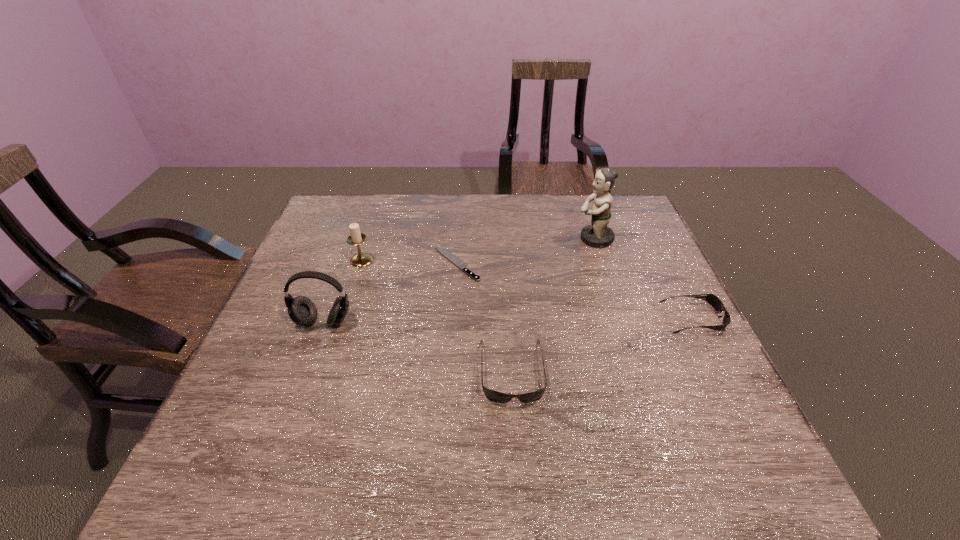
Image resolution: width=960 pixels, height=540 pixels. I want to click on vacant point located on the front-facing side of the tallest object, so click(x=536, y=239).

Locate an element on the screen. The height and width of the screenshot is (540, 960). free space located 0.130m on the front-facing side of the tallest object is located at coordinates (533, 239).

You are a GUI agent. You are given a task and a screenshot of the screen. Output one action in this format:
    pyautogui.click(x=<x>, y=<y>)
    Task: Click on the vacant space situated 0.180m on the front-facing side of the tallest object
    
    Given the screenshot: What is the action you would take?
    (x=516, y=239)

You are a GUI agent. You are given a task and a screenshot of the screen. Output one action in this format:
    pyautogui.click(x=<x>, y=<y>)
    Task: Click on the vacant space located 0.280m on the right of the third tallest object
    
    Given the screenshot: What is the action you would take?
    pyautogui.click(x=471, y=260)

Image resolution: width=960 pixels, height=540 pixels. Identify the location of vacant area located 0.340m on the right of the shortest object. (601, 264).

Locate an element on the screen. This screenshot has height=540, width=960. blank space located on the ear cups of the headset is located at coordinates (293, 407).

The image size is (960, 540). What are the coordinates of `object that is at the far edge` in the screenshot? It's located at (597, 234).

Locate an element on the screen. object situated at the near edge is located at coordinates (495, 396).

At what (x,y) coordinates should I click in order to perform the action: click on candle holder that is positioned at the left edge. Please return your answer as a coordinate pair (x, y). The image size is (960, 540). Looking at the image, I should click on (361, 259).

Identify the location of headset located at the left edge. (302, 311).